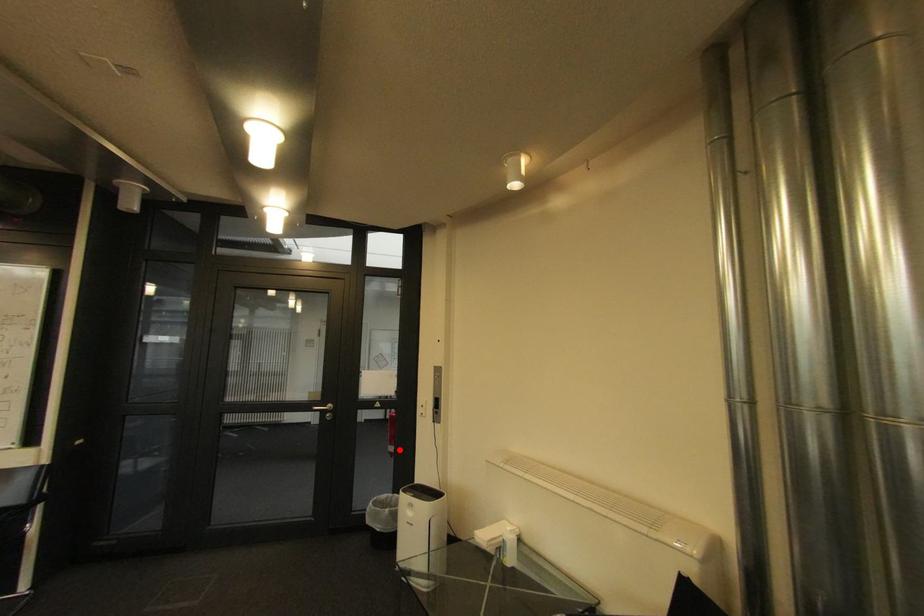
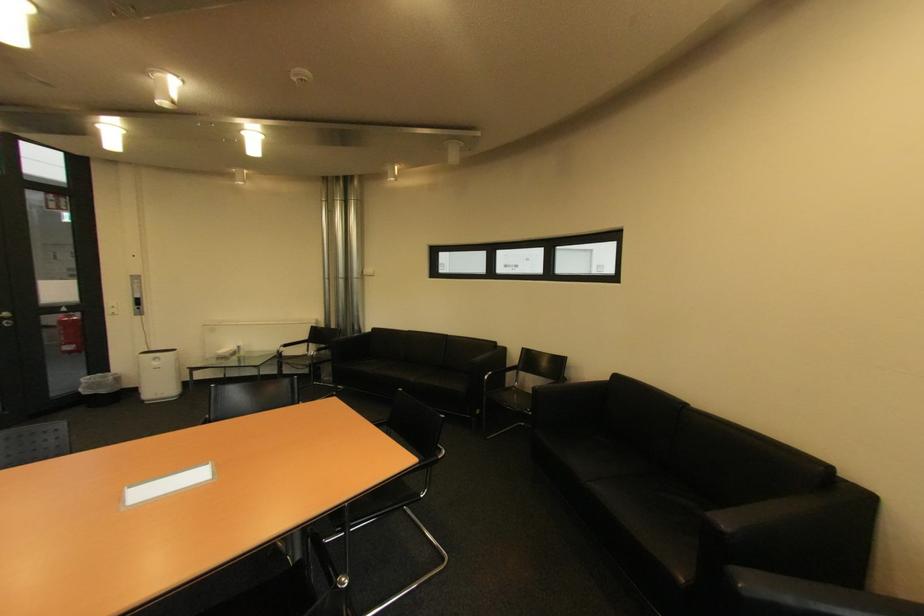
Question: I am providing you with two images of the same scene from different viewpoints. Image1 has a red point marked. In image2, the corresponding 3D location appears at what relative position? Reply with the corresponding letter.

Choices:
 (A) Closer
 (B) Farther

Answer: (A)